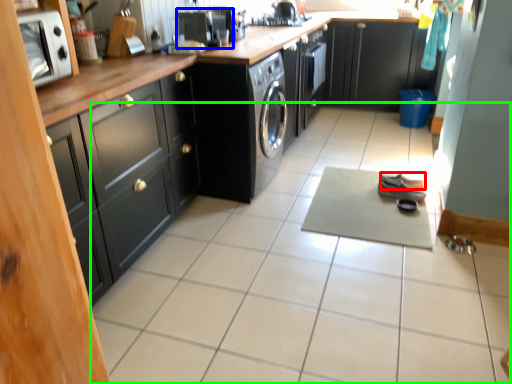
Question: Estimate the real-world distances between objects in this image. Which object is farther from shoe (highlighted by a red box), appliance (highlighted by a blue box) or ceramic tile (highlighted by a green box)?

Choices:
 (A) appliance
 (B) ceramic tile

Answer: (A)